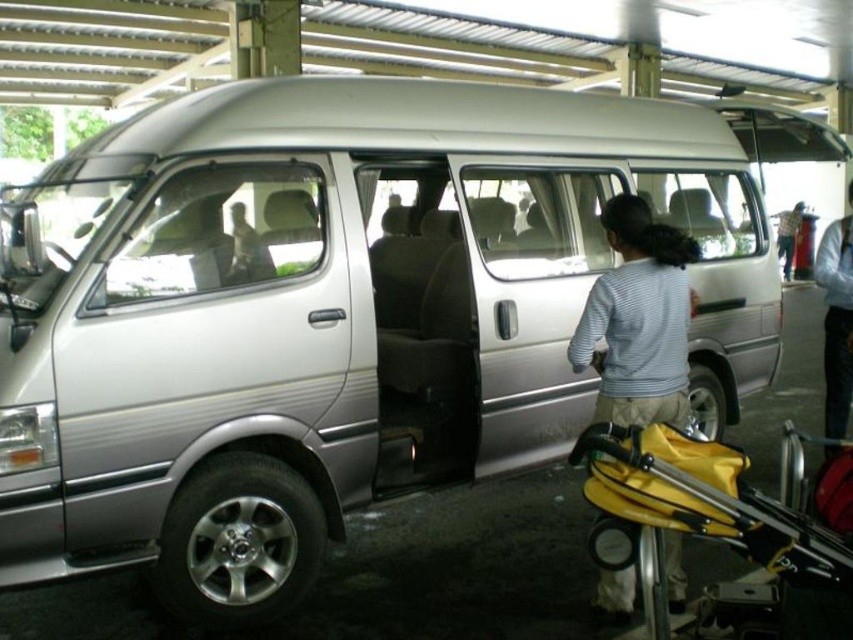
You are a delivery person who needs to place a large package in the van without blocking the baby carriage at point [692,509]. Where should you place the package?

The yellow plastic baby carriage at lower right is located at point [692,509], so you should place the package in another area of the van that does not block this location.

You are a photographer trying to capture a clear photo of the striped fabric shirt at center without the yellow plastic baby carriage at lower right blocking it. How should you adjust your position?

Move your camera position behind the striped fabric shirt at center so that it is between you and the yellow plastic baby carriage at lower right, since the yellow plastic baby carriage at lower right is currently in front of the striped fabric shirt at center.